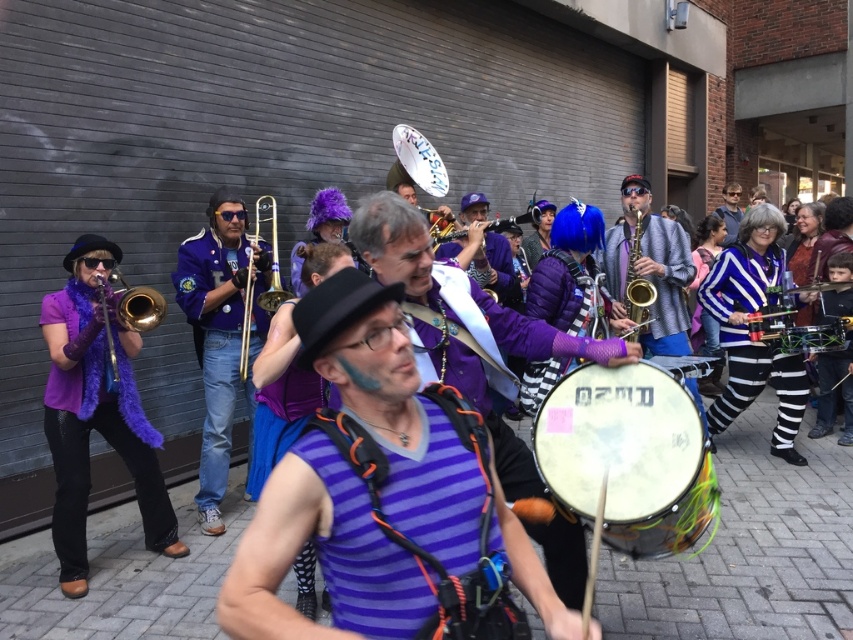
You are a street performer who needs to pack your equipment into a case that can only accommodate items up to 1 meter in height. You have a striped fabric drum at center and a purple matte trumpet at center. Which item might not fit based on their heights?

The striped fabric drum at center has a greater height compared to the purple matte trumpet at center. Therefore, the striped fabric drum at center might not fit into the case if it exceeds the 1 meter height limit.

You are standing in front of the band and want to move towards the point that is closer to you. Which point should you move towards, point (635,291) or point (827,333)?

You should move towards point (635,291) because it is closer to the viewer than point (827,333).

You are a photographer trying to capture both the matte purple scarf at left and the gold brass trumpet at center in a single frame. Which object should you focus on first to ensure both are in the frame without moving the camera?

You should focus on the matte purple scarf at left first because it is larger than the gold brass trumpet at center, so centering it would help include both in the frame.